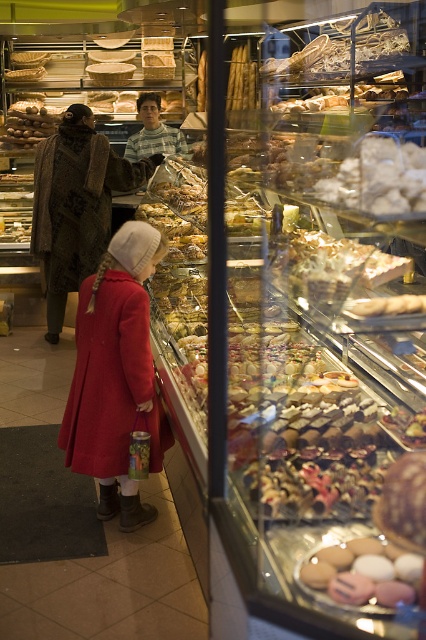
What do you see at coordinates (115, 376) in the screenshot?
I see `matte red coat at center` at bounding box center [115, 376].

What are the coordinates of `matte red coat at center` in the screenshot? It's located at (115, 376).

Locate an element on the screen. matte red coat at center is located at coordinates (115, 376).

Which of these two, matte red coat at center or brown textured coat at center, stands taller?

With more height is brown textured coat at center.

Does matte red coat at center appear on the right side of brown textured coat at center?

Yes, matte red coat at center is to the right of brown textured coat at center.

Does point (129, 353) come behind point (54, 163)?

That is False.

You are a GUI agent. You are given a task and a screenshot of the screen. Output one action in this format:
    pyautogui.click(x=<x>, y=<y>)
    Task: Click on the matte red coat at center
    The image size is (426, 640).
    Given the screenshot: What is the action you would take?
    pyautogui.click(x=115, y=376)

Is brown textured coat at center thinner than matte pink macarons at center?

In fact, brown textured coat at center might be wider than matte pink macarons at center.

Does point (34, 160) come closer to viewer compared to point (339, 595)?

No, it is not.

The width and height of the screenshot is (426, 640). Find the location of `brown textured coat at center`. brown textured coat at center is located at coordinates (75, 205).